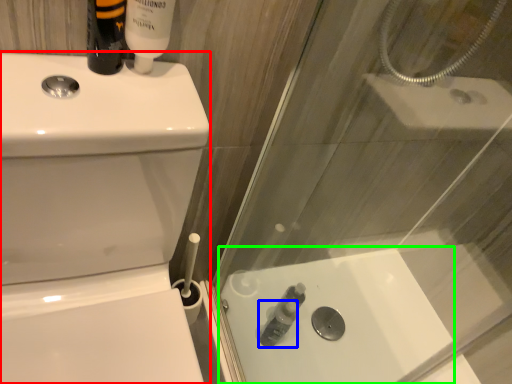
Question: Estimate the real-world distances between objects in this image. Which object is farther from toilet bowl (highlighted by a red box), toiletry (highlighted by a blue box) or bath (highlighted by a green box)?

Choices:
 (A) toiletry
 (B) bath

Answer: (A)